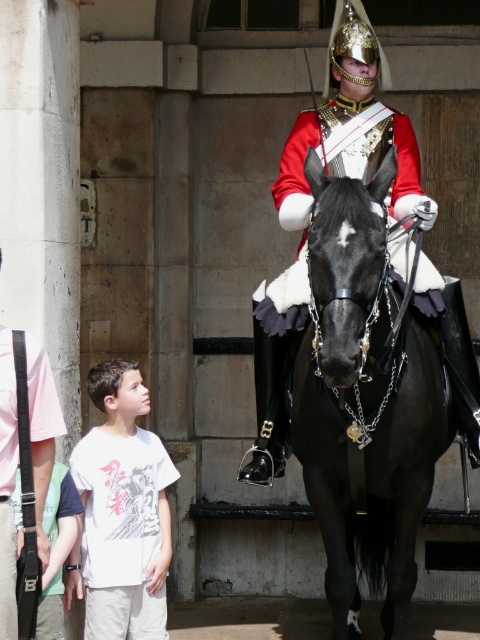
Does shiny black armor at center appear under white cotton t-shirt at lower left?

No, shiny black armor at center is not below white cotton t-shirt at lower left.

Is shiny black armor at center wider than white cotton t-shirt at lower left?

Yes.

You are a GUI agent. You are given a task and a screenshot of the screen. Output one action in this format:
    pyautogui.click(x=<x>, y=<y>)
    Task: Click on the shiny black armor at center
    The height and width of the screenshot is (640, 480).
    Given the screenshot: What is the action you would take?
    pyautogui.click(x=351, y=131)

Where is `shiny black armor at center`? This screenshot has width=480, height=640. shiny black armor at center is located at coordinates (351, 131).

Between point (367, 93) and point (3, 452), which one is positioned in front?

Point (3, 452) is in front.

Who is more distant from viewer, [336,51] or [52,392]?

The point [336,51] is behind.

The image size is (480, 640). What do you see at coordinates (351, 131) in the screenshot?
I see `shiny black armor at center` at bounding box center [351, 131].

I want to click on shiny black armor at center, so [x=351, y=131].

Is black glossy horse at center smaller than white cotton t-shirt at lower left?

Actually, black glossy horse at center might be larger than white cotton t-shirt at lower left.

Which is more to the right, black glossy horse at center or white cotton t-shirt at lower left?

From the viewer's perspective, black glossy horse at center appears more on the right side.

Which is in front, point (450, 436) or point (98, 550)?

Point (98, 550)

Where is `black glossy horse at center`? The image size is (480, 640). black glossy horse at center is located at coordinates (364, 403).